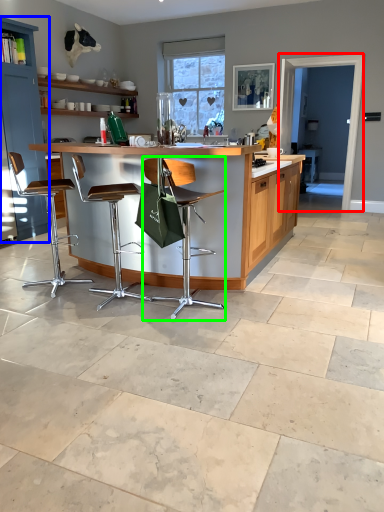
Question: Estimate the real-world distances between objects in this image. Which object is closer to glass door (highlighted by a red box), cabinetry (highlighted by a blue box) or chair (highlighted by a green box)?

Choices:
 (A) cabinetry
 (B) chair

Answer: (A)